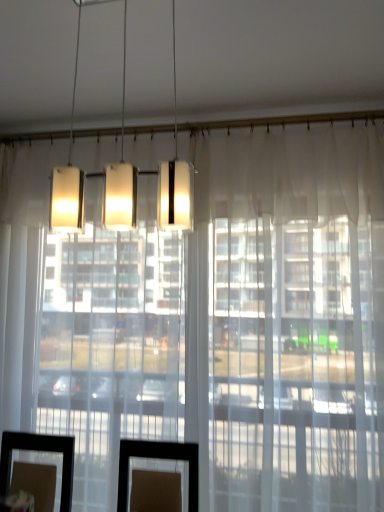
Question: Can you confirm if transparent glass door at center, which is the second glass door from right to left, is taller than matte white rectangular light fixture at upper center?

Choices:
 (A) no
 (B) yes

Answer: (B)

Question: Does transparent glass door at center, the first glass door from the left, have a lesser height compared to matte white rectangular light fixture at upper center?

Choices:
 (A) no
 (B) yes

Answer: (A)

Question: From the image's perspective, is transparent glass door at center, which is the second glass door from right to left, under matte white rectangular light fixture at upper center?

Choices:
 (A) no
 (B) yes

Answer: (B)

Question: Is transparent glass door at center, which is the second glass door from right to left, closer to camera compared to matte white rectangular light fixture at upper center?

Choices:
 (A) yes
 (B) no

Answer: (B)

Question: Can you confirm if transparent glass door at center, the first glass door from the left, is thinner than matte white rectangular light fixture at upper center?

Choices:
 (A) no
 (B) yes

Answer: (A)

Question: Is point (266, 262) positioned closer to the camera than point (130, 174)?

Choices:
 (A) closer
 (B) farther

Answer: (B)

Question: From the image's perspective, is transparent glass door at center, arranged as the 2th glass door when viewed from the left, above or below matte white rectangular light fixture at upper center?

Choices:
 (A) below
 (B) above

Answer: (A)

Question: Looking at the image, does transparent glass door at center, arranged as the 2th glass door when viewed from the left, seem bigger or smaller compared to matte white rectangular light fixture at upper center?

Choices:
 (A) small
 (B) big

Answer: (B)

Question: In terms of width, does transparent glass door at center, arranged as the 2th glass door when viewed from the left, look wider or thinner when compared to matte white rectangular light fixture at upper center?

Choices:
 (A) wide
 (B) thin

Answer: (A)

Question: Do you think transparent glass door at center, the first glass door from the left, is within matte white rectangular light fixture at upper center, or outside of it?

Choices:
 (A) outside
 (B) inside

Answer: (A)

Question: Considering the positions of transparent glass door at center, the first glass door from the left, and matte white rectangular light fixture at upper center in the image, is transparent glass door at center, the first glass door from the left, wider or thinner than matte white rectangular light fixture at upper center?

Choices:
 (A) wide
 (B) thin

Answer: (A)

Question: In the image, is transparent glass door at center, the first glass door from the left, positioned in front of or behind matte white rectangular light fixture at upper center?

Choices:
 (A) behind
 (B) front

Answer: (A)

Question: From the image's perspective, relative to matte white rectangular light fixture at upper center, is transparent glass door at center, which is the second glass door from right to left, above or below?

Choices:
 (A) above
 (B) below

Answer: (B)

Question: Is point (175, 190) closer or farther from the camera than point (158, 302)?

Choices:
 (A) farther
 (B) closer

Answer: (B)

Question: From their relative heights in the image, would you say matte white rectangular light fixture at upper center is taller or shorter than transparent glass door at center, the first glass door from the left?

Choices:
 (A) short
 (B) tall

Answer: (A)